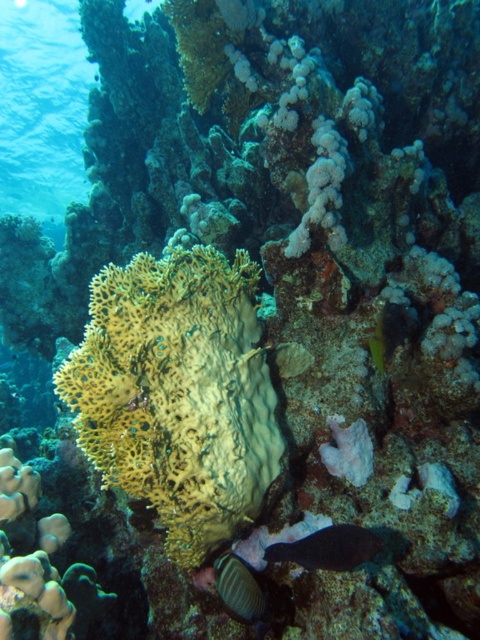
You are a marine biologist observing this underwater scene. You notice the yellow sponge at center and the smooth dark blue fish at lower center. Which object is taller?

The yellow sponge at center is taller than the smooth dark blue fish at lower center.

You are a scuba diver swimming in the coral reef scene. You notice two points marked in the image. The first point is at coordinates point (327, 550), and the second point is at point (248, 572). Which point is closer to you as you face the reef?

Point (327, 550) is in front of point (248, 572), so it is closer to you as you face the reef.

You are a marine biologist studying the coral reef. You notice a point at coordinates (178,394) in the image. Based on the scene, which object does this point belong to?

The point at coordinates (178,394) is on the yellow sponge at center.